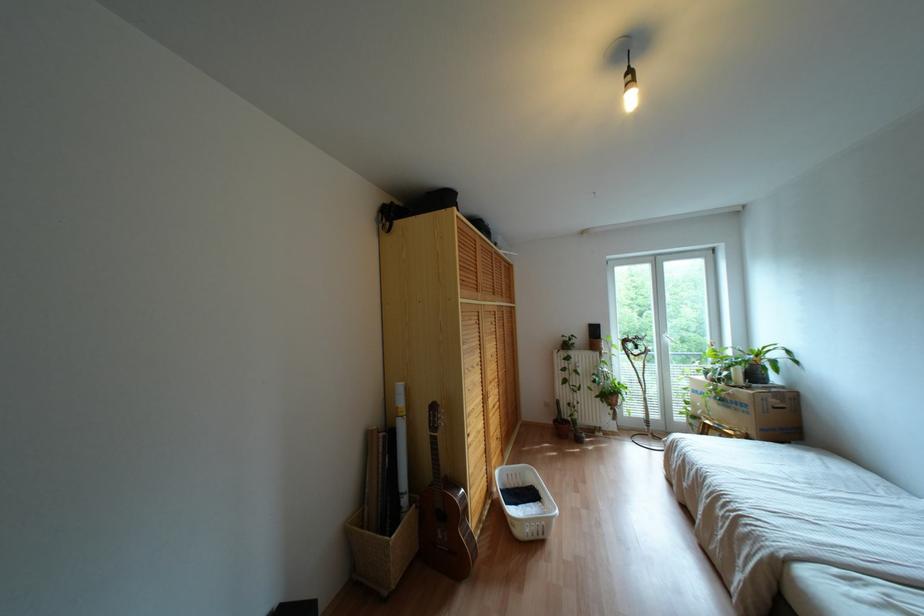
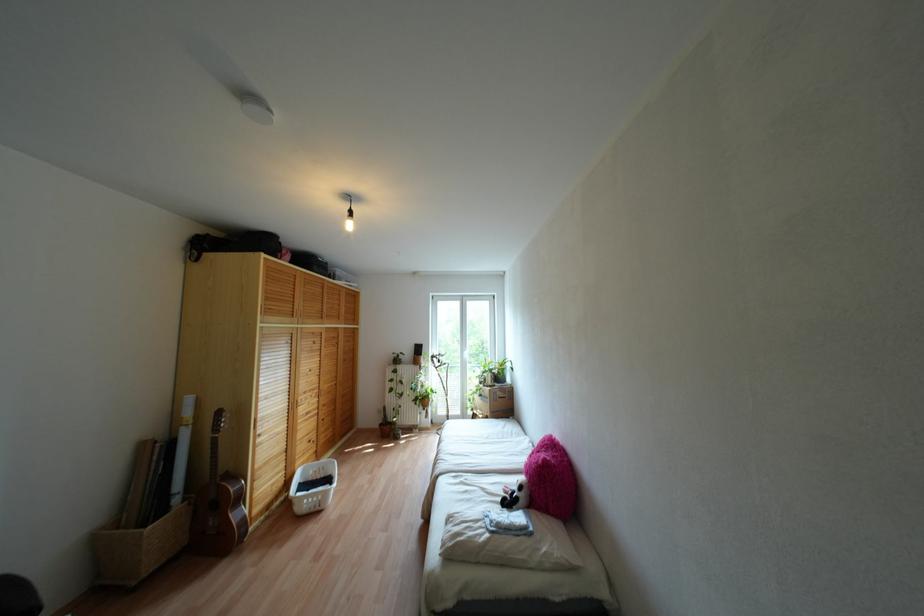
Locate, in the second image, the point that corresponds to (x=630, y=100) in the first image.

(348, 225)